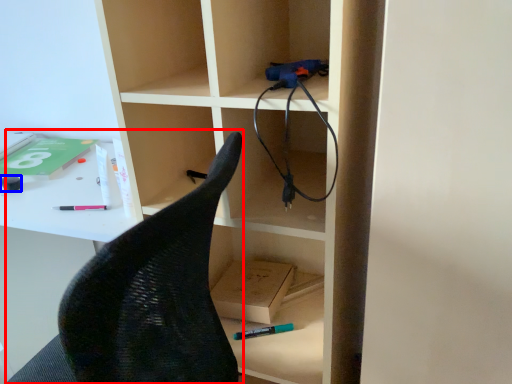
Question: Which of the following is the closest to the observer, armchair (highlighted by a red box) or stationery (highlighted by a blue box)?

Choices:
 (A) armchair
 (B) stationery

Answer: (A)